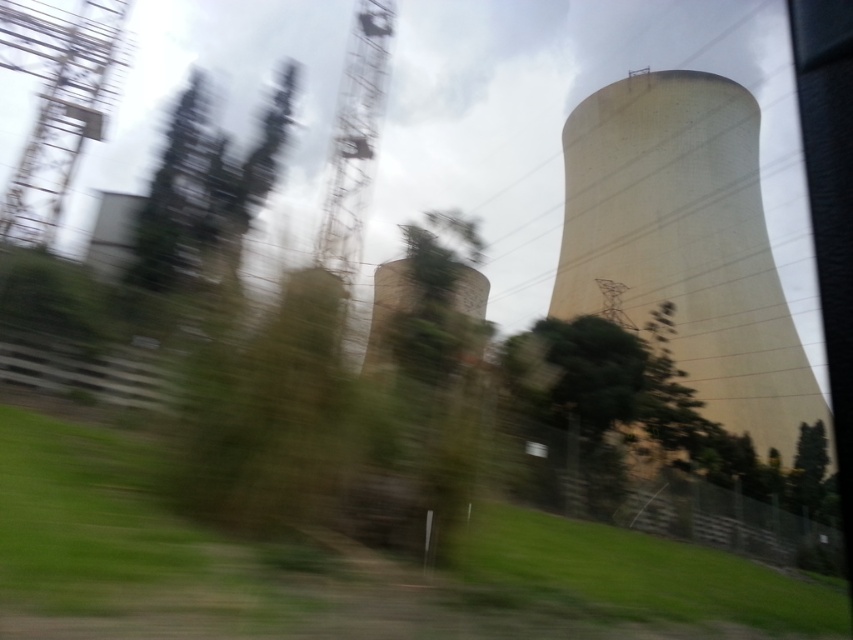
Between smooth concrete tower at right and rusty metal tower at center, which one is positioned lower?

Positioned lower is smooth concrete tower at right.

Can you confirm if smooth concrete tower at right is positioned above rusty metal tower at center?

Actually, smooth concrete tower at right is below rusty metal tower at center.

Between point (659, 148) and point (350, 97), which one is positioned in front?

Positioned in front is point (659, 148).

You are a GUI agent. You are given a task and a screenshot of the screen. Output one action in this format:
    pyautogui.click(x=<x>, y=<y>)
    Task: Click on the smooth concrete tower at right
    This screenshot has width=853, height=640.
    Given the screenshot: What is the action you would take?
    pyautogui.click(x=688, y=244)

Between smooth concrete tower at right and green leafy tree at left, which one is positioned lower?

smooth concrete tower at right

Which is in front, point (706, 154) or point (248, 173)?

Point (248, 173) is in front.

Measure the distance between point (x=718, y=192) and camera.

Point (x=718, y=192) is 33.63 meters away from camera.

In order to click on smooth concrete tower at right in this screenshot , I will do `click(688, 244)`.

Does green leafy tree at left have a larger size compared to rusty metal tower at center?

Incorrect, green leafy tree at left is not larger than rusty metal tower at center.

Consider the image. Between green leafy tree at left and rusty metal tower at center, which one appears on the left side from the viewer's perspective?

From the viewer's perspective, green leafy tree at left appears more on the left side.

Which is behind, point (167, 224) or point (317, 262)?

Point (317, 262)

Identify the location of green leafy tree at left. (204, 188).